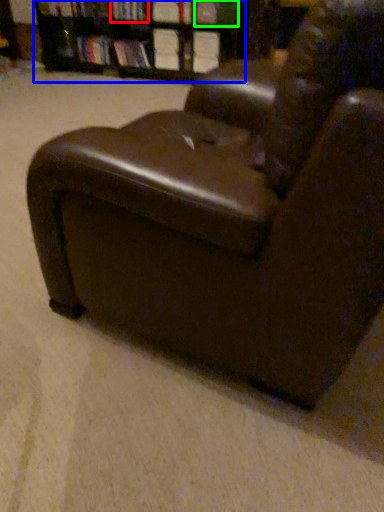
Question: Based on their relative distances, which object is farther from book (highlighted by a red box)? Choose from bookcase (highlighted by a blue box) and book (highlighted by a green box).

Choices:
 (A) bookcase
 (B) book

Answer: (B)